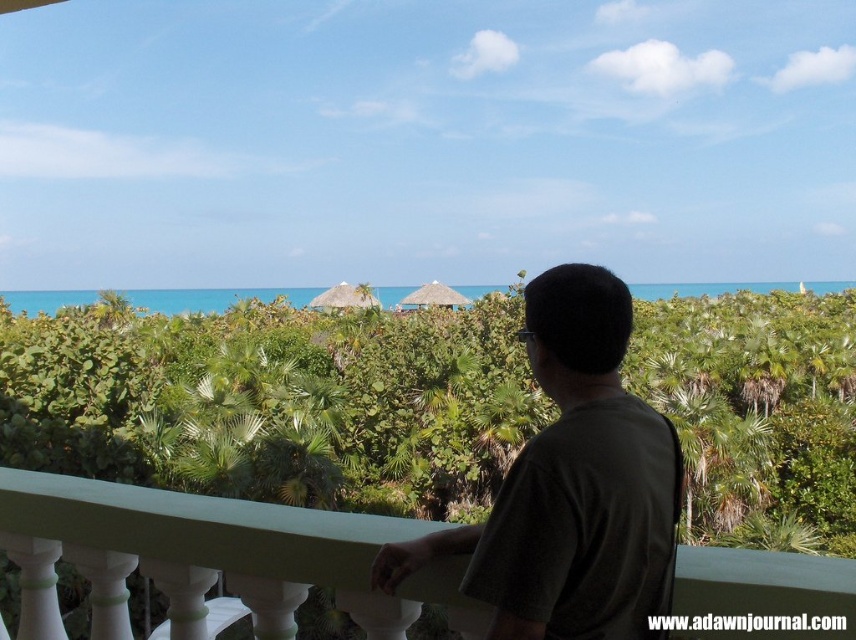
Question: Which point appears closest to the camera in this image?

Choices:
 (A) (290, 548)
 (B) (629, 333)

Answer: (B)

Question: Does green painted wood railing at center appear on the right side of dark green t-shirt at center?

Choices:
 (A) no
 (B) yes

Answer: (A)

Question: Which point is closer to the camera?

Choices:
 (A) (528, 508)
 (B) (849, 589)

Answer: (B)

Question: Is green painted wood railing at center thinner than dark green t-shirt at center?

Choices:
 (A) yes
 (B) no

Answer: (B)

Question: Is green painted wood railing at center closer to camera compared to dark green t-shirt at center?

Choices:
 (A) no
 (B) yes

Answer: (A)

Question: Among these points, which one is farthest from the camera?

Choices:
 (A) (43, 604)
 (B) (652, 426)

Answer: (A)